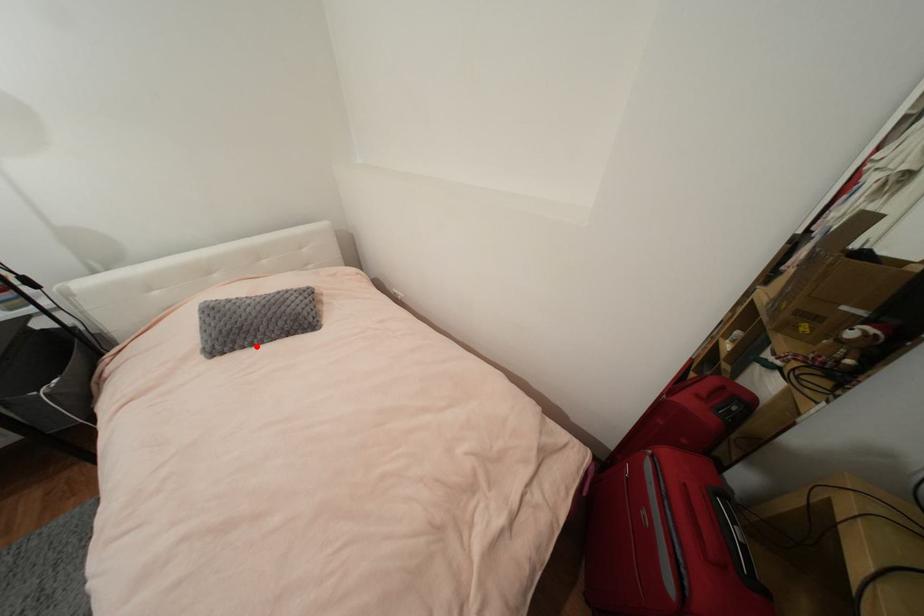
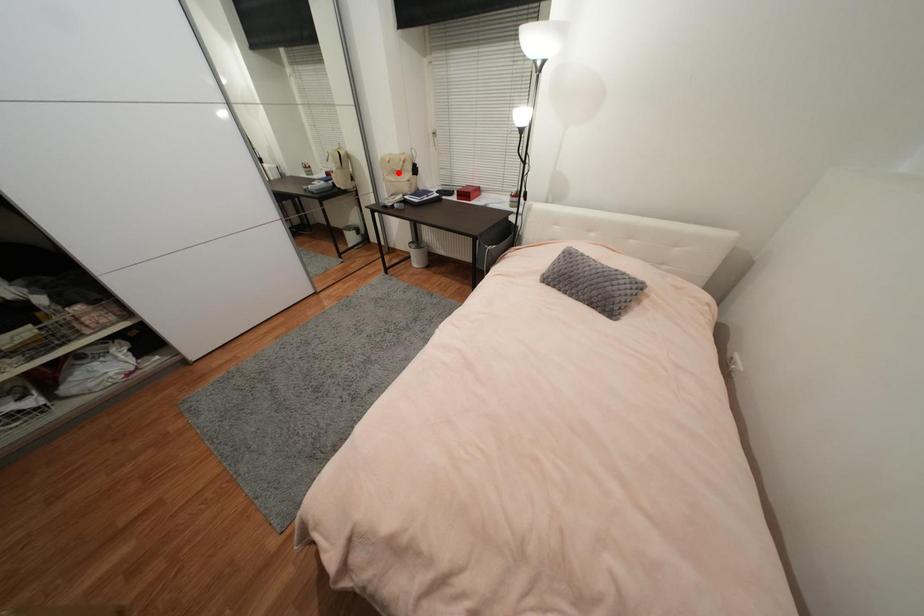
I am providing you with two images of the same scene from different viewpoints. A red point is marked on the first image and another point is marked on the second image. Is the red point in image1 aligned with the point shown in image2?

No